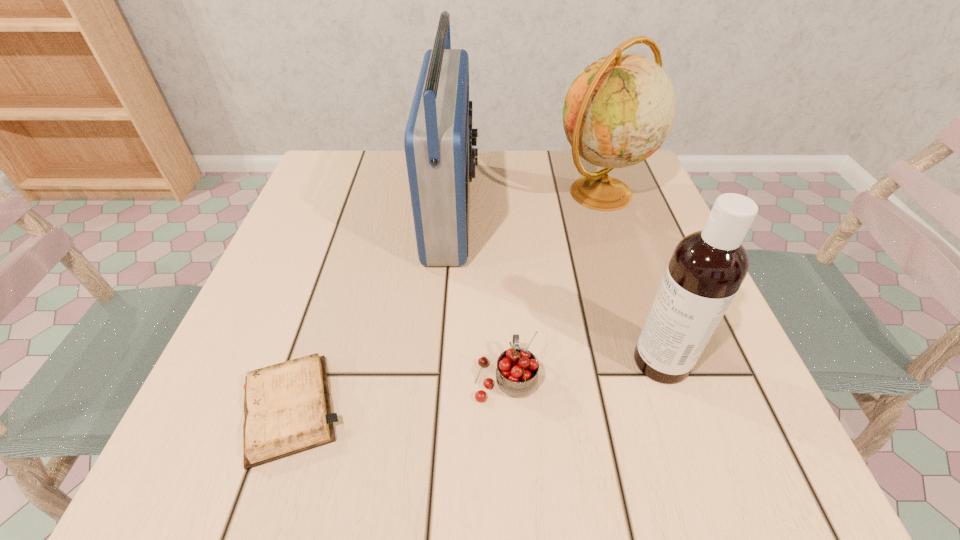
This screenshot has height=540, width=960. What are the coordinates of `vacant space located on the label side of the dishwasher detergent` in the screenshot? It's located at (574, 361).

Where is `free spot located on the handle side of the second shortest object`? Image resolution: width=960 pixels, height=540 pixels. free spot located on the handle side of the second shortest object is located at coordinates (502, 303).

At what (x,y) coordinates should I click in order to perform the action: click on vacant space situated on the handle side of the second shortest object. Please return your answer as a coordinate pair (x, y). Image resolution: width=960 pixels, height=540 pixels. Looking at the image, I should click on (503, 322).

This screenshot has width=960, height=540. Identify the location of vacant space located on the handle side of the second shortest object. (501, 275).

The image size is (960, 540). I want to click on vacant space located on the right of the shortest object, so click(x=468, y=408).

I want to click on radio receiver located in the far edge section of the desktop, so click(438, 140).

The height and width of the screenshot is (540, 960). In order to click on globe that is positioned at the far edge in this screenshot , I will do `click(620, 109)`.

You are a GUI agent. You are given a task and a screenshot of the screen. Output one action in this format:
    pyautogui.click(x=<x>, y=<y>)
    Task: Click on the object at the near edge
    
    Given the screenshot: What is the action you would take?
    pyautogui.click(x=287, y=409)

Locate an element on the screen. object that is at the left edge is located at coordinates (287, 409).

What are the coordinates of `globe at the right edge` in the screenshot? It's located at (620, 109).